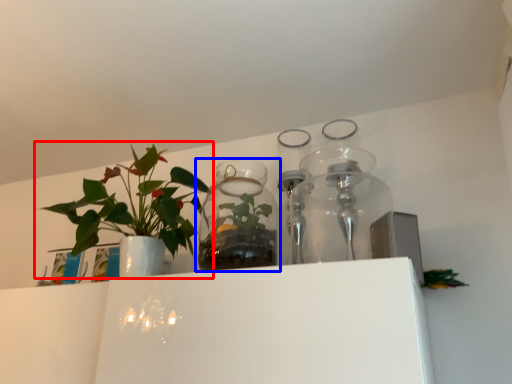
Question: Which object appears farthest to the camera in this image, houseplant (highlighted by a red box) or vase (highlighted by a blue box)?

Choices:
 (A) houseplant
 (B) vase

Answer: (B)